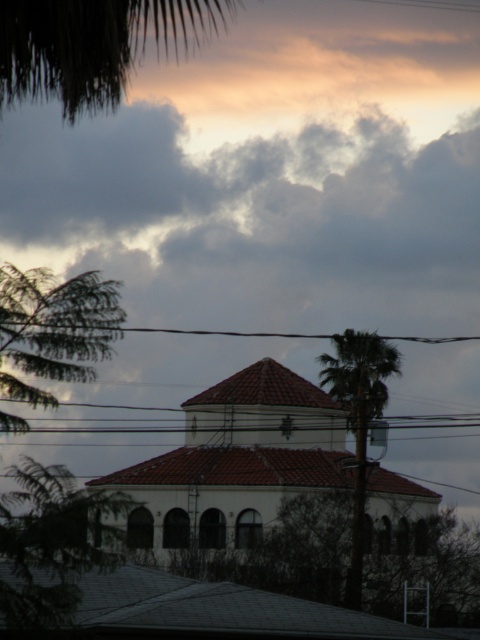
You are standing at the base of the green leafy palm at center and want to look for a green leafy tree at lower left. In which direction should you look to find it?

The green leafy tree at lower left is located below the green leafy palm at center, so you should look downward to find it.

You are standing at the center of the image and want to locate the green leafy tree at lower left. According to the coordinates provided, in which direction should you look to find it?

The green leafy tree at lower left is located at coordinates point (52, 544), so you should look to the lower left direction to find it.

You are standing in front of the building with the red roof and looking towards the green leafy palm at center. Which direction should you turn to see the green leafy tree at lower left?

The green leafy tree at lower left is to the left of the green leafy palm at center. So you should turn to your left to see the green leafy tree at lower left.